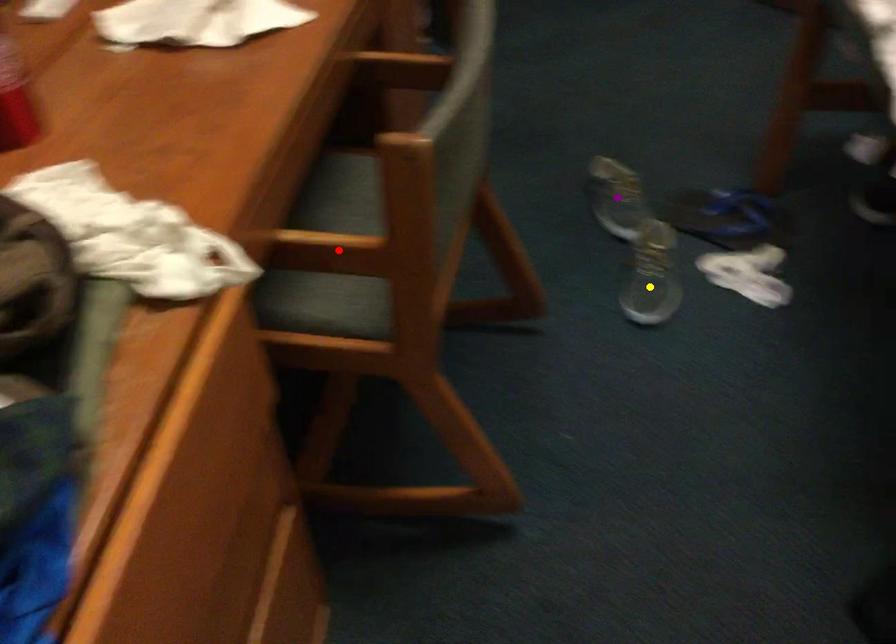
In the scene shown: Order these from nearest to farthest:
1. yellow point
2. purple point
3. red point

red point → yellow point → purple point